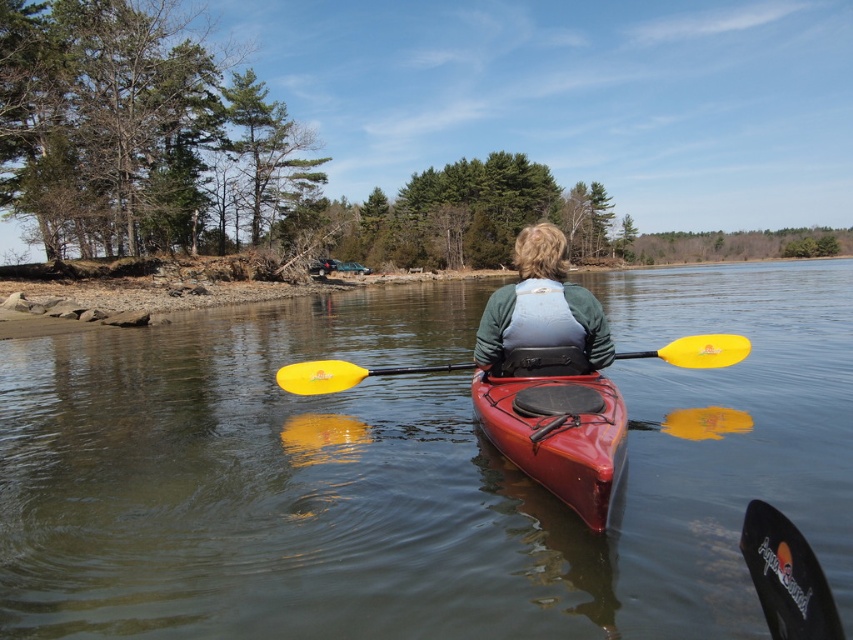
You are a photographer trying to capture the reflection of the matte red kayak at center and the yellow matte paddle at center on the water. Since the water is still, you know that reflections are mirrored. Which object will appear further to the right in its reflection?

The matte red kayak at center is positioned on the left side of yellow matte paddle at center, so in the reflection, the matte red kayak at center will appear further to the right than the yellow matte paddle at center.

You are standing on the shore and want to take a photo of the clear water at center and the matte red kayak at center. Which object should you focus on first to ensure both are in focus?

You should focus on the matte red kayak at center first because it is farther away from the viewer than the clear water at center, so focusing on the farther object ensures both are in focus.